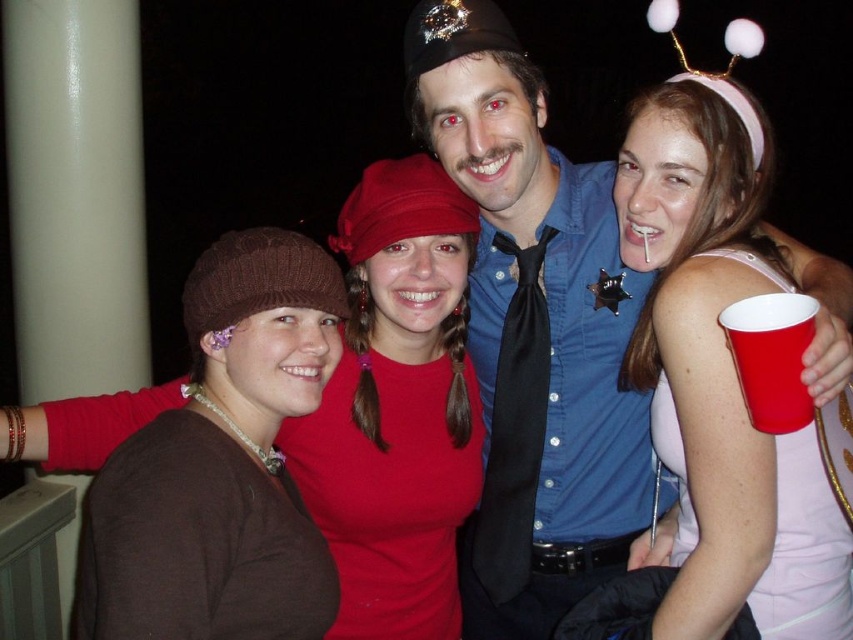
You are planning to take a photo of the group and need to ensure that the pink satin dress at center and the brown knit beanie at left are both visible in the frame. Given their sizes, which one might require more careful framing to avoid being obscured by other elements?

The pink satin dress at center is thinner than the brown knit beanie at left, so it might require more careful framing to avoid being obscured by other elements since it has a smaller width.

You are organizing a costume party and need to determine which of the two items, the pink satin dress at center or the brown knit beanie at left, would require more storage space. Based on their sizes, which one should be stored first?

The pink satin dress at center is larger in size than the brown knit beanie at left, so it should be stored first to accommodate its bigger size.